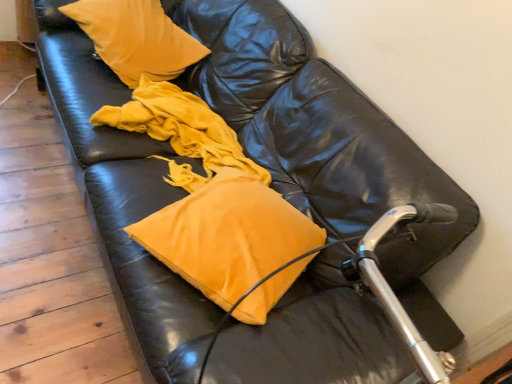
Where is `velvet yellow pillow at upper left, which ranks as the 1th pillow in top-to-bottom order`? The image size is (512, 384). velvet yellow pillow at upper left, which ranks as the 1th pillow in top-to-bottom order is located at coordinates click(x=136, y=38).

What do you see at coordinates (227, 235) in the screenshot? I see `matte yellow pillow at center, the 1th pillow positioned from the bottom` at bounding box center [227, 235].

I want to click on velvet yellow pillow at upper left, marked as the 2th pillow in a front-to-back arrangement, so click(136, 38).

Which is behind, matte yellow pillow at center, marked as the second pillow in a top-to-bottom arrangement, or velvet yellow pillow at upper left, marked as the 2th pillow in a front-to-back arrangement?

Positioned behind is velvet yellow pillow at upper left, marked as the 2th pillow in a front-to-back arrangement.

This screenshot has width=512, height=384. What are the coordinates of `pillow that is below the velvet yellow pillow at upper left, which ranks as the 1th pillow in top-to-bottom order (from the image's perspective)` in the screenshot? It's located at (227, 235).

Considering the positions of objects matte yellow pillow at center, marked as the second pillow in a top-to-bottom arrangement, and velvet yellow pillow at upper left, placed as the 2th pillow when sorted from bottom to top, in the image provided, who is more to the left, matte yellow pillow at center, marked as the second pillow in a top-to-bottom arrangement, or velvet yellow pillow at upper left, placed as the 2th pillow when sorted from bottom to top,?

Positioned to the left is velvet yellow pillow at upper left, placed as the 2th pillow when sorted from bottom to top.

From a real-world perspective, which is physically below, matte yellow pillow at center, acting as the first pillow starting from the front, or velvet yellow pillow at upper left, the 1th pillow in the back-to-front sequence?

matte yellow pillow at center, acting as the first pillow starting from the front.

Between matte yellow pillow at center, marked as the second pillow in a top-to-bottom arrangement, and matte yellow pillow at center, which one has less height?

matte yellow pillow at center, marked as the second pillow in a top-to-bottom arrangement.

Is matte yellow pillow at center, the 1th pillow positioned from the bottom, with matte yellow pillow at center?

They are not placed beside each other.

From a real-world perspective, which is physically above, matte yellow pillow at center, marked as the second pillow in a top-to-bottom arrangement, or matte yellow pillow at center?

matte yellow pillow at center, marked as the second pillow in a top-to-bottom arrangement.

In the image, is matte yellow pillow at center, marked as the second pillow in a top-to-bottom arrangement, positioned in front of or behind matte yellow pillow at center?

matte yellow pillow at center, marked as the second pillow in a top-to-bottom arrangement, is positioned closer to the viewer than matte yellow pillow at center.

Does matte yellow pillow at center have a greater height compared to matte yellow pillow at center, the 1th pillow positioned from the bottom?

Yes, matte yellow pillow at center is taller than matte yellow pillow at center, the 1th pillow positioned from the bottom.

Which is more to the right, matte yellow pillow at center or matte yellow pillow at center, the 1th pillow positioned from the bottom?

matte yellow pillow at center, the 1th pillow positioned from the bottom.

Is matte yellow pillow at center thinner than matte yellow pillow at center, acting as the first pillow starting from the front?

No.

Does velvet yellow pillow at upper left, which ranks as the 1th pillow in top-to-bottom order, lie in front of matte yellow pillow at center?

No.

How far apart are velvet yellow pillow at upper left, placed as the 2th pillow when sorted from bottom to top, and matte yellow pillow at center?

The distance of velvet yellow pillow at upper left, placed as the 2th pillow when sorted from bottom to top, from matte yellow pillow at center is 10.12 inches.

Is velvet yellow pillow at upper left, which ranks as the 1th pillow in top-to-bottom order, at the right side of matte yellow pillow at center?

In fact, velvet yellow pillow at upper left, which ranks as the 1th pillow in top-to-bottom order, is to the left of matte yellow pillow at center.

Is velvet yellow pillow at upper left, placed as the 2th pillow when sorted from bottom to top, oriented away from matte yellow pillow at center?

No, velvet yellow pillow at upper left, placed as the 2th pillow when sorted from bottom to top, is not facing the opposite direction of matte yellow pillow at center.

Based on their sizes in the image, would you say velvet yellow pillow at upper left, which ranks as the 1th pillow in top-to-bottom order, is bigger or smaller than matte yellow pillow at center, positioned as the second pillow in back-to-front order?

In the image, velvet yellow pillow at upper left, which ranks as the 1th pillow in top-to-bottom order, appears to be larger than matte yellow pillow at center, positioned as the second pillow in back-to-front order.

Is velvet yellow pillow at upper left, marked as the 2th pillow in a front-to-back arrangement, spatially inside matte yellow pillow at center, positioned as the second pillow in back-to-front order, or outside of it?

velvet yellow pillow at upper left, marked as the 2th pillow in a front-to-back arrangement, cannot be found inside matte yellow pillow at center, positioned as the second pillow in back-to-front order.

From the picture: Measure the distance between velvet yellow pillow at upper left, marked as the 2th pillow in a front-to-back arrangement, and matte yellow pillow at center, marked as the second pillow in a top-to-bottom arrangement.

84.00 centimeters.

From a real-world perspective, is velvet yellow pillow at upper left, which ranks as the 1th pillow in top-to-bottom order, positioned over matte yellow pillow at center, marked as the second pillow in a top-to-bottom arrangement, based on gravity?

Yes, from a real-world perspective, velvet yellow pillow at upper left, which ranks as the 1th pillow in top-to-bottom order, is on top of matte yellow pillow at center, marked as the second pillow in a top-to-bottom arrangement.

Is matte yellow pillow at center oriented away from velvet yellow pillow at upper left, which ranks as the 1th pillow in top-to-bottom order?

matte yellow pillow at center is not turned away from velvet yellow pillow at upper left, which ranks as the 1th pillow in top-to-bottom order.

Are matte yellow pillow at center and velvet yellow pillow at upper left, the 1th pillow in the back-to-front sequence, far apart?

No, matte yellow pillow at center is in close proximity to velvet yellow pillow at upper left, the 1th pillow in the back-to-front sequence.

Which of these two, matte yellow pillow at center or velvet yellow pillow at upper left, which ranks as the 1th pillow in top-to-bottom order, is bigger?

With larger size is matte yellow pillow at center.

Is matte yellow pillow at center not inside velvet yellow pillow at upper left, the 1th pillow in the back-to-front sequence?

Indeed, matte yellow pillow at center is completely outside velvet yellow pillow at upper left, the 1th pillow in the back-to-front sequence.

This screenshot has height=384, width=512. Identify the location of pillow on the left side of matte yellow pillow at center, acting as the first pillow starting from the front. (136, 38).

You are a GUI agent. You are given a task and a screenshot of the screen. Output one action in this format:
    pyautogui.click(x=<x>, y=<y>)
    Task: Click on the material that appears above the matte yellow pillow at center, acting as the first pillow starting from the front (from the image's perspective)
    The height and width of the screenshot is (384, 512).
    Given the screenshot: What is the action you would take?
    pyautogui.click(x=181, y=131)

Estimate the real-world distances between objects in this image. Which object is further from velvet yellow pillow at upper left, which ranks as the 1th pillow in top-to-bottom order, matte yellow pillow at center or matte yellow pillow at center, marked as the second pillow in a top-to-bottom arrangement?

matte yellow pillow at center, marked as the second pillow in a top-to-bottom arrangement, is positioned further to the anchor velvet yellow pillow at upper left, which ranks as the 1th pillow in top-to-bottom order.

Based on their spatial positions, is matte yellow pillow at center, marked as the second pillow in a top-to-bottom arrangement, or matte yellow pillow at center further from velvet yellow pillow at upper left, marked as the 2th pillow in a front-to-back arrangement?

matte yellow pillow at center, marked as the second pillow in a top-to-bottom arrangement, is positioned further to the anchor velvet yellow pillow at upper left, marked as the 2th pillow in a front-to-back arrangement.

Which object lies nearer to the anchor point matte yellow pillow at center, positioned as the second pillow in back-to-front order, velvet yellow pillow at upper left, the 1th pillow in the back-to-front sequence, or matte yellow pillow at center?

The object closer to matte yellow pillow at center, positioned as the second pillow in back-to-front order, is matte yellow pillow at center.

Looking at the image, which one is located further to matte yellow pillow at center, velvet yellow pillow at upper left, placed as the 2th pillow when sorted from bottom to top, or matte yellow pillow at center, marked as the second pillow in a top-to-bottom arrangement?

matte yellow pillow at center, marked as the second pillow in a top-to-bottom arrangement, is further to matte yellow pillow at center.

From the image, which object appears to be nearer to matte yellow pillow at center, matte yellow pillow at center, acting as the first pillow starting from the front, or velvet yellow pillow at upper left, marked as the 2th pillow in a front-to-back arrangement?

Among the two, velvet yellow pillow at upper left, marked as the 2th pillow in a front-to-back arrangement, is located nearer to matte yellow pillow at center.

When comparing their distances from matte yellow pillow at center, acting as the first pillow starting from the front, does matte yellow pillow at center or velvet yellow pillow at upper left, the 1th pillow in the back-to-front sequence, seem closer?

matte yellow pillow at center is closer to matte yellow pillow at center, acting as the first pillow starting from the front.

Find the location of `material that lies between velvet yellow pillow at upper left, the 1th pillow in the back-to-front sequence, and matte yellow pillow at center, acting as the first pillow starting from the front, from top to bottom`. material that lies between velvet yellow pillow at upper left, the 1th pillow in the back-to-front sequence, and matte yellow pillow at center, acting as the first pillow starting from the front, from top to bottom is located at coordinates (181, 131).